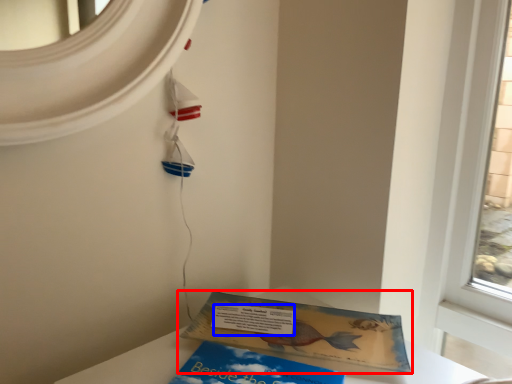
Question: Which point is further to the camera, book (highlighted by a red box) or writing (highlighted by a blue box)?

Choices:
 (A) book
 (B) writing

Answer: (B)